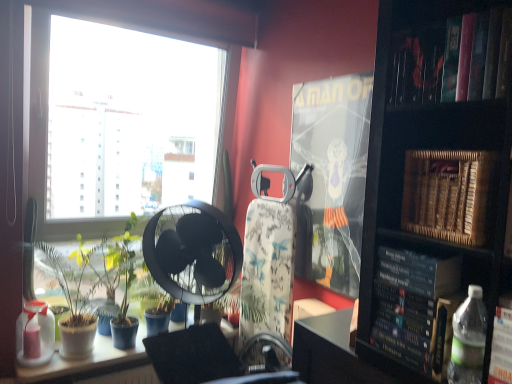
Question: Does white glossy table at lower left touch translucent plastic bottle at lower left, placed as the first bottle when sorted from back to front?

Choices:
 (A) yes
 (B) no

Answer: (B)

Question: Is the depth of white glossy table at lower left less than that of translucent plastic bottle at lower left, the first bottle from the left?

Choices:
 (A) yes
 (B) no

Answer: (A)

Question: Does white glossy table at lower left appear on the right side of translucent plastic bottle at lower left, the second bottle when ordered from front to back?

Choices:
 (A) yes
 (B) no

Answer: (A)

Question: Can you confirm if white glossy table at lower left is bigger than translucent plastic bottle at lower left, the second bottle from the right?

Choices:
 (A) yes
 (B) no

Answer: (A)

Question: Is white glossy table at lower left smaller than translucent plastic bottle at lower left, the second bottle from the right?

Choices:
 (A) no
 (B) yes

Answer: (A)

Question: Does white glossy table at lower left have a greater width compared to translucent plastic bottle at lower left, the second bottle from the right?

Choices:
 (A) no
 (B) yes

Answer: (B)

Question: Can hardcover book at upper right be found inside translucent plastic bottle at lower left, the second bottle from the right?

Choices:
 (A) no
 (B) yes

Answer: (A)

Question: Can you confirm if translucent plastic bottle at lower left, placed as the second bottle when sorted from top to bottom, is positioned to the left of hardcover book at upper right?

Choices:
 (A) no
 (B) yes

Answer: (B)

Question: From the image's perspective, is translucent plastic bottle at lower left, placed as the second bottle when sorted from top to bottom, above hardcover book at upper right?

Choices:
 (A) no
 (B) yes

Answer: (A)

Question: From a real-world perspective, is translucent plastic bottle at lower left, the first bottle from the left, on hardcover book at upper right?

Choices:
 (A) no
 (B) yes

Answer: (A)

Question: Does translucent plastic bottle at lower left, the 1th bottle when ordered from bottom to top, have a lesser height compared to hardcover book at upper right?

Choices:
 (A) no
 (B) yes

Answer: (A)

Question: Does translucent plastic bottle at lower left, the second bottle from the right, lie behind hardcover book at upper right?

Choices:
 (A) no
 (B) yes

Answer: (B)

Question: Is hardcover book at right, which appears as the 2th paperback book when viewed from the back, next to metallic swivel chair at center?

Choices:
 (A) no
 (B) yes

Answer: (A)